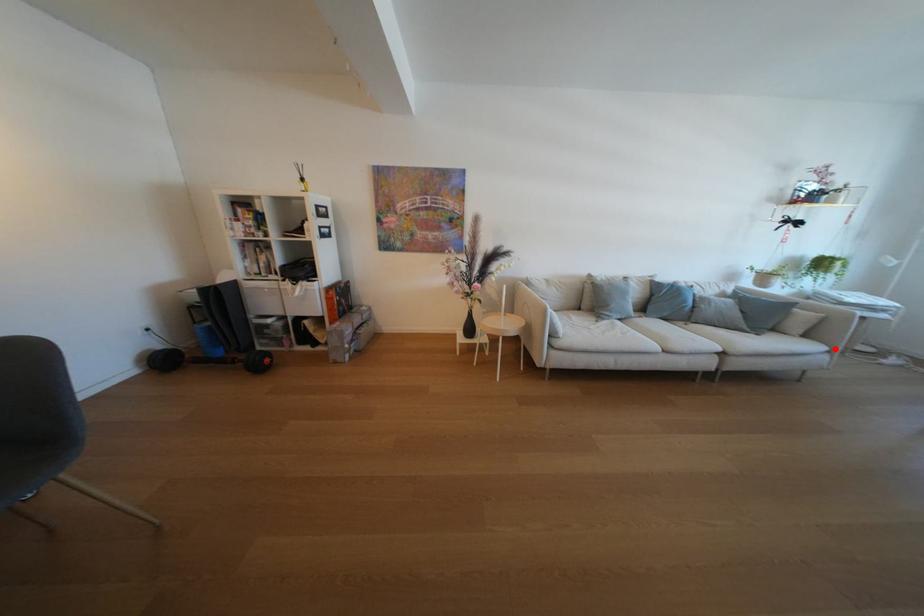
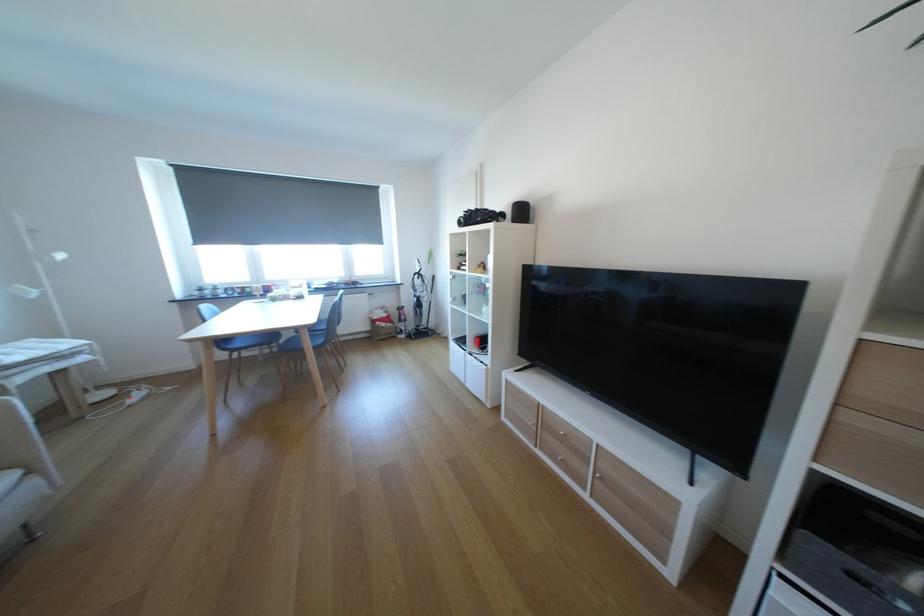
Where in the second image is the point corresponding to the highlighted location from the first image?

(21, 477)